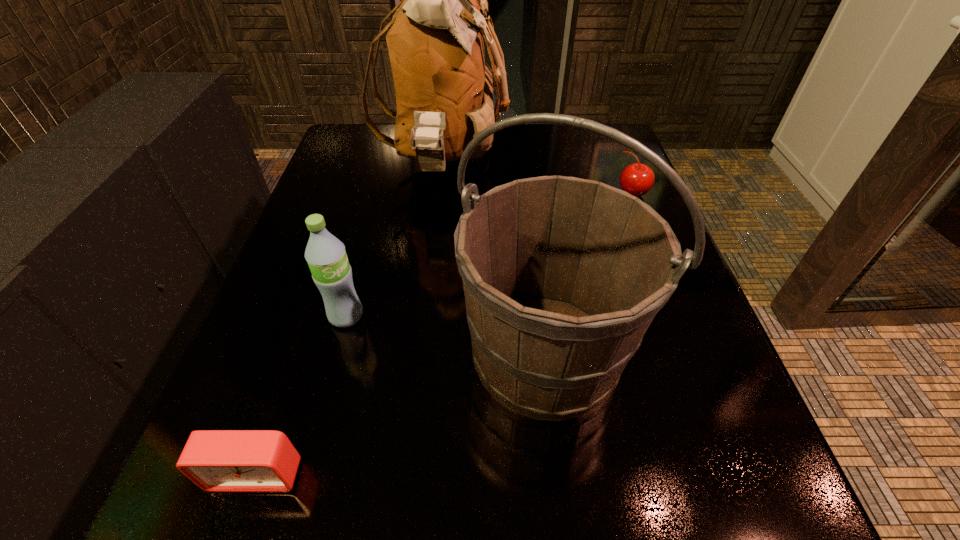
Locate an element on the screen. object that is at the far edge is located at coordinates (444, 88).

You are a GUI agent. You are given a task and a screenshot of the screen. Output one action in this format:
    pyautogui.click(x=<x>, y=<y>)
    Task: Click on the object present at the near edge
    The width and height of the screenshot is (960, 540).
    Given the screenshot: What is the action you would take?
    pyautogui.click(x=215, y=460)

I want to click on backpack present at the left edge, so click(444, 88).

Image resolution: width=960 pixels, height=540 pixels. In order to click on water bottle that is at the left edge in this screenshot , I will do `click(326, 256)`.

At what (x,y) coordinates should I click in order to perform the action: click on alarm clock at the left edge. Please return your answer as a coordinate pair (x, y). This screenshot has width=960, height=540. Looking at the image, I should click on (215, 460).

Image resolution: width=960 pixels, height=540 pixels. I want to click on bucket present at the right edge, so click(x=562, y=276).

You are a GUI agent. You are given a task and a screenshot of the screen. Output one action in this format:
    pyautogui.click(x=<x>, y=<y>)
    Task: Click on the cherry at the right edge
    The image size is (960, 540).
    Given the screenshot: What is the action you would take?
    pos(637,179)

What are the coordinates of `object that is at the far left corner` in the screenshot? It's located at (444, 88).

At what (x,y) coordinates should I click in order to perform the action: click on object located in the near left corner section of the desktop. Please return your answer as a coordinate pair (x, y). Looking at the image, I should click on (215, 460).

Locate an element on the screen. free space at the far edge of the desktop is located at coordinates coord(540,129).